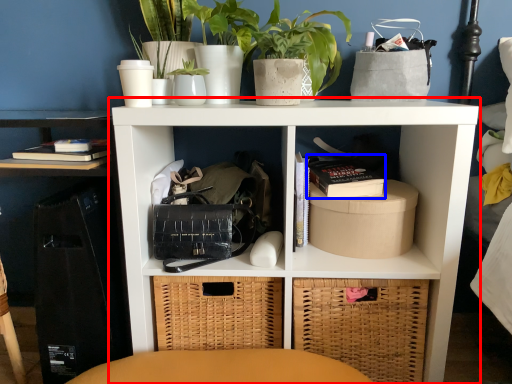
Question: Which of the following is the farthest to the observer, shelf (highlighted by a red box) or book (highlighted by a blue box)?

Choices:
 (A) shelf
 (B) book

Answer: (B)